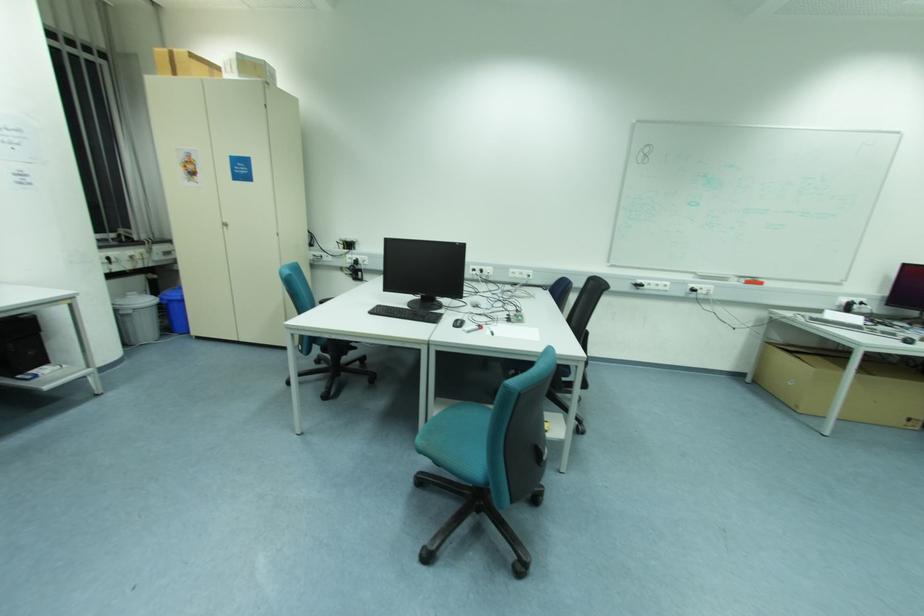
What do you see at coordinates (134, 302) in the screenshot? The width and height of the screenshot is (924, 616). I see `the grey trash can lid` at bounding box center [134, 302].